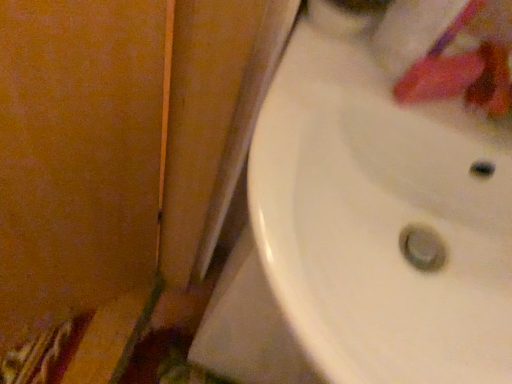
What do you see at coordinates (390, 194) in the screenshot? This screenshot has width=512, height=384. I see `white glossy sink at center` at bounding box center [390, 194].

Locate an element on the screen. The width and height of the screenshot is (512, 384). white glossy sink at center is located at coordinates (390, 194).

Locate an element on the screen. white glossy sink at center is located at coordinates (390, 194).